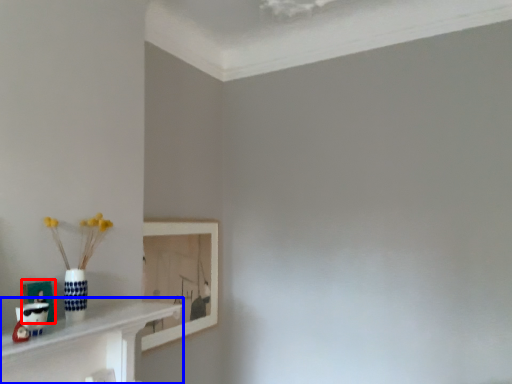
Question: Which of the following is the closest to the observer, picture frame (highlighted by a red box) or shelf (highlighted by a blue box)?

Choices:
 (A) picture frame
 (B) shelf

Answer: (B)